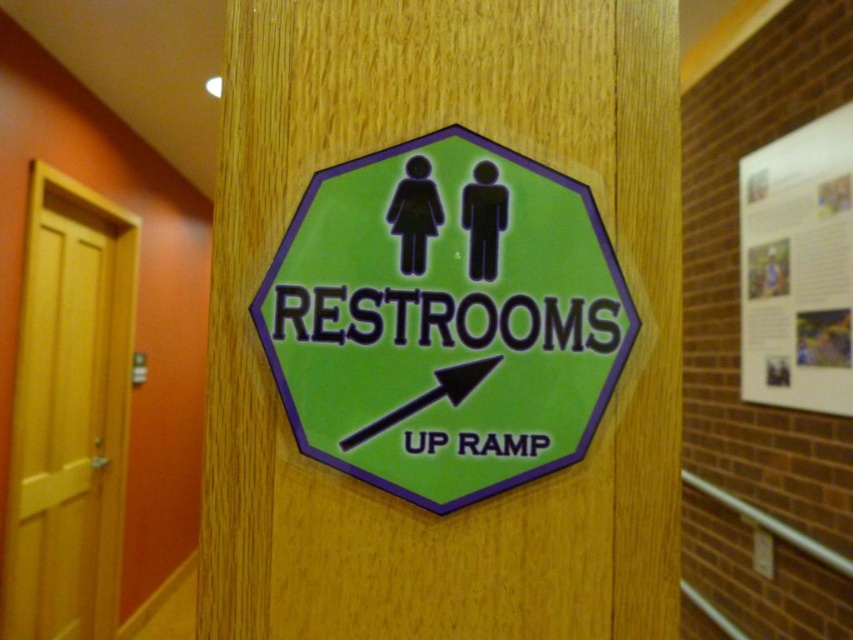
Is green plastic sign at center positioned behind white paper poster at upper right?

No, it is in front of white paper poster at upper right.

Does point (321, 198) come in front of point (798, 177)?

Yes, point (321, 198) is closer to viewer.

Who is more distant from viewer, (514, 278) or (744, 188)?

Point (744, 188)

Where is `green plastic sign at center`? This screenshot has height=640, width=853. green plastic sign at center is located at coordinates (444, 317).

In the scene shown: Does yellow wood door at left appear on the left side of white paper poster at upper right?

Indeed, yellow wood door at left is positioned on the left side of white paper poster at upper right.

Is point (15, 621) positioned before point (759, 166)?

Yes, point (15, 621) is closer to viewer.

Locate an element on the screen. yellow wood door at left is located at coordinates (68, 413).

Consider the image. Is green plastic sign at center further to the viewer compared to yellow wood door at left?

No, green plastic sign at center is in front of yellow wood door at left.

Does green plastic sign at center have a greater height compared to yellow wood door at left?

In fact, green plastic sign at center may be shorter than yellow wood door at left.

Describe the element at coordinates (444, 317) in the screenshot. Image resolution: width=853 pixels, height=640 pixels. I see `green plastic sign at center` at that location.

Locate an element on the screen. green plastic sign at center is located at coordinates (444, 317).